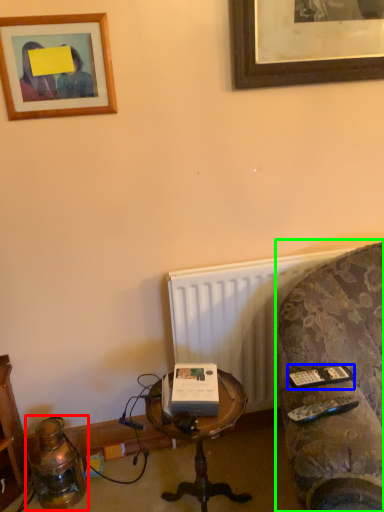
Question: Which is farther away from table lamp (highlighted by a red box)? remote (highlighted by a blue box) or studio couch (highlighted by a green box)?

Choices:
 (A) remote
 (B) studio couch

Answer: (B)